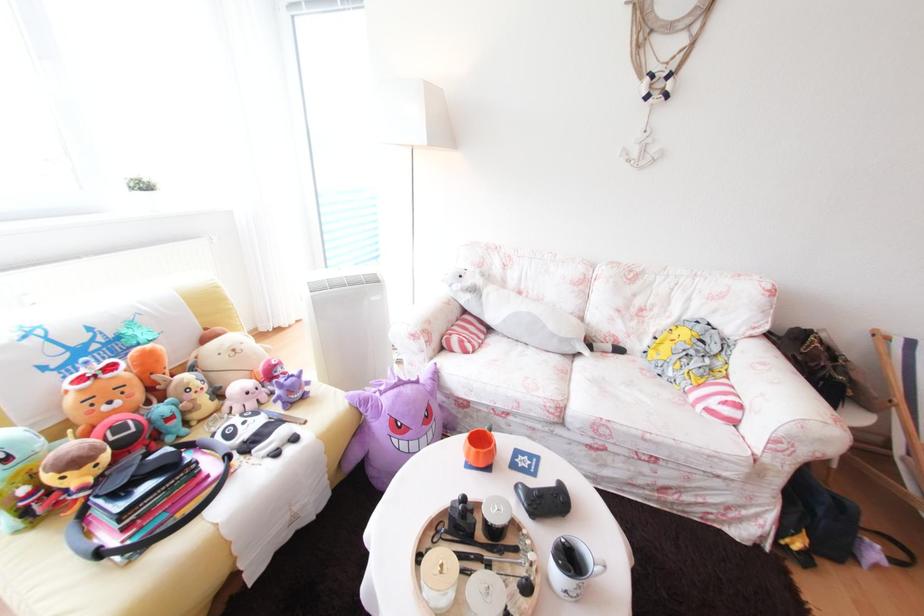
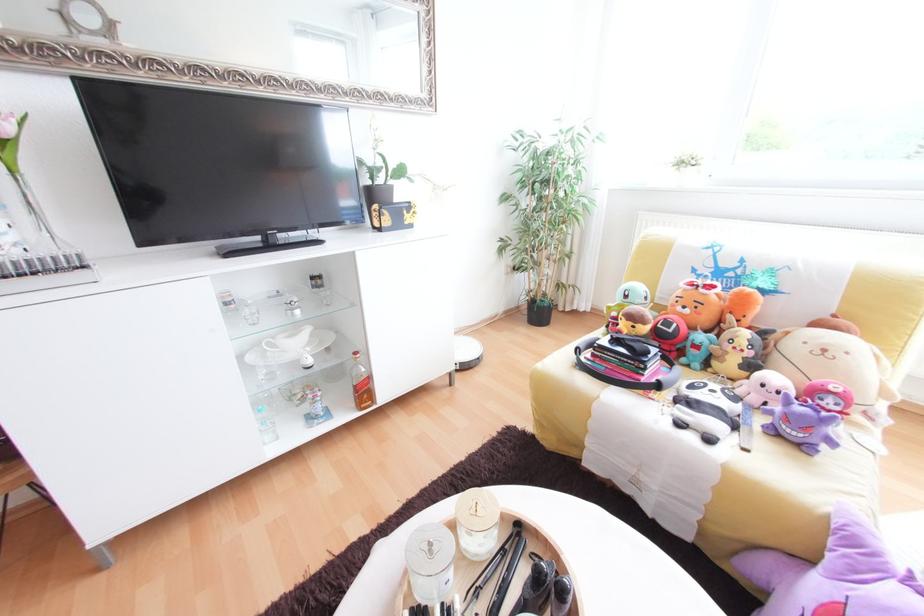
Locate, in the second image, the point that corresponds to [113,451] in the first image.

(652, 323)